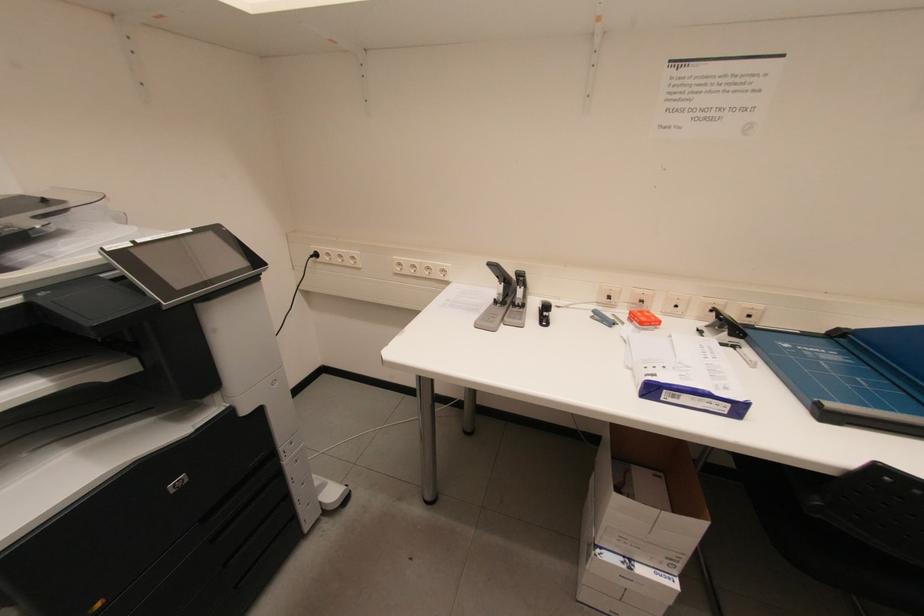
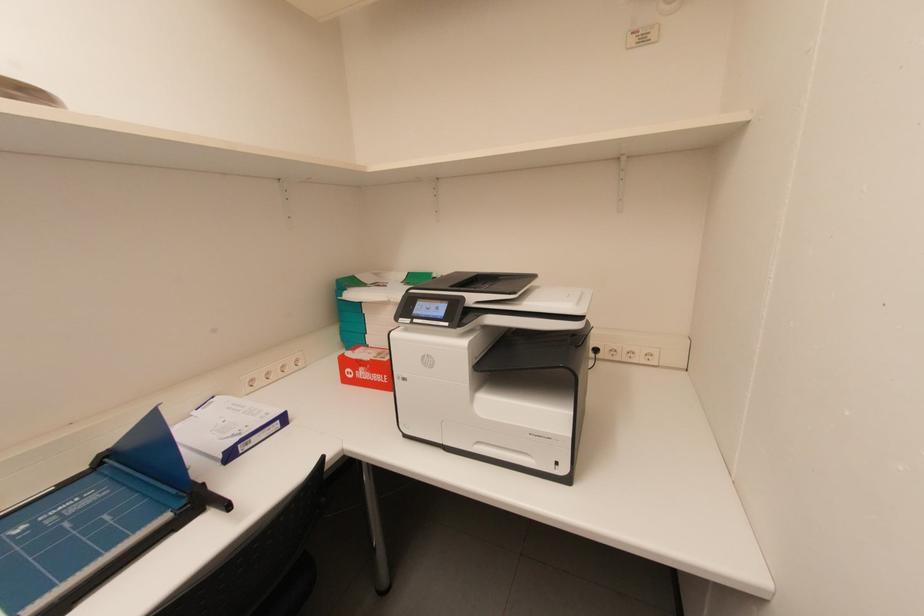
Question: How did the camera likely rotate?

Choices:
 (A) Left
 (B) Right
 (C) Up
 (D) Down

Answer: (B)